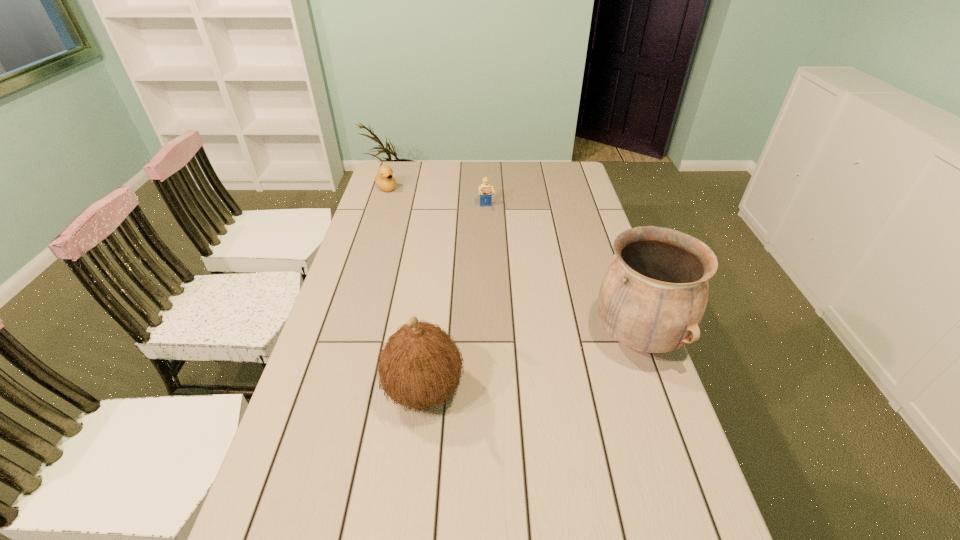
The width and height of the screenshot is (960, 540). I want to click on vacant space located on the face of the Lego, so click(x=493, y=236).

In order to click on vacant area situated on the face of the Lego in this screenshot , I will do `click(495, 246)`.

Image resolution: width=960 pixels, height=540 pixels. What are the coordinates of `vacant area located 0.230m on the face of the Lego` in the screenshot? It's located at (496, 248).

This screenshot has width=960, height=540. Find the location of `free space located 0.310m facing forward on the farthest object`. free space located 0.310m facing forward on the farthest object is located at coordinates pyautogui.click(x=426, y=230).

This screenshot has width=960, height=540. Find the location of `vacant space situated facing forward on the farthest object`. vacant space situated facing forward on the farthest object is located at coordinates (396, 199).

Identify the location of vacant space located facing forward on the farthest object. (396, 200).

Where is `object that is at the far edge`? This screenshot has height=540, width=960. object that is at the far edge is located at coordinates (384, 180).

Locate an element on the screen. This screenshot has height=540, width=960. object that is at the left edge is located at coordinates (384, 180).

Find the location of a particular element. The image size is (960, 540). object that is at the right edge is located at coordinates (653, 295).

Locate an element on the screen. object at the far left corner is located at coordinates click(x=384, y=180).